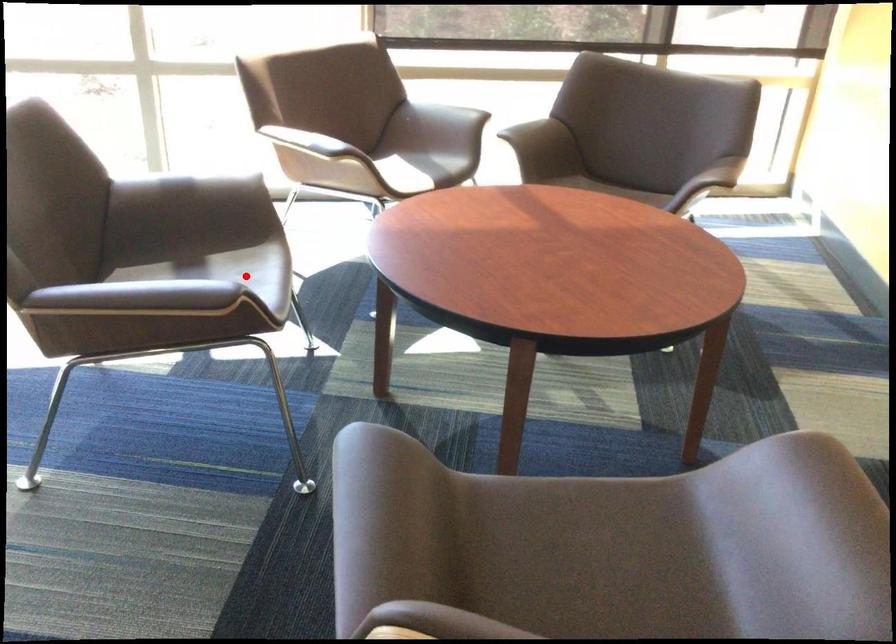
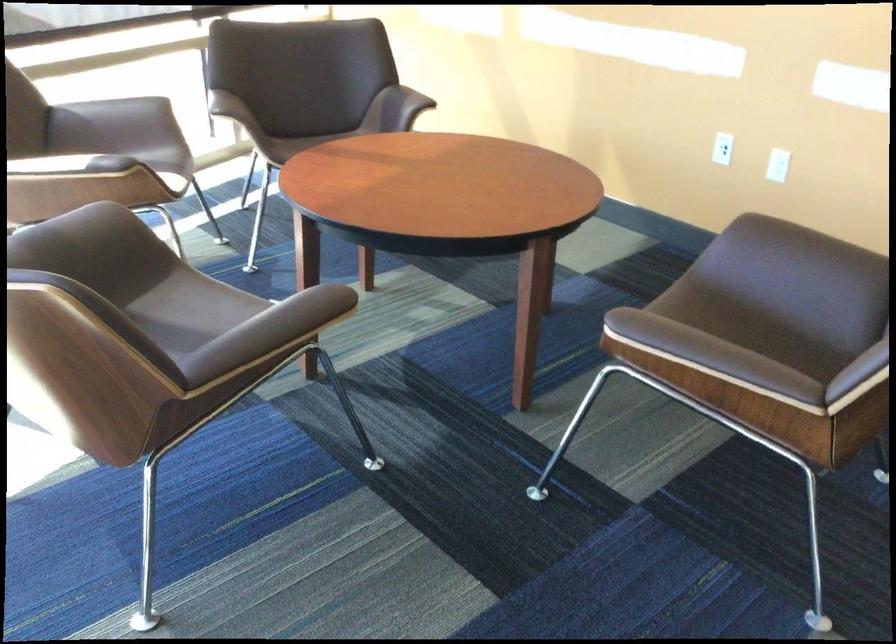
Find the pixel in the second image that matches the highlighted location in the first image.

(191, 310)